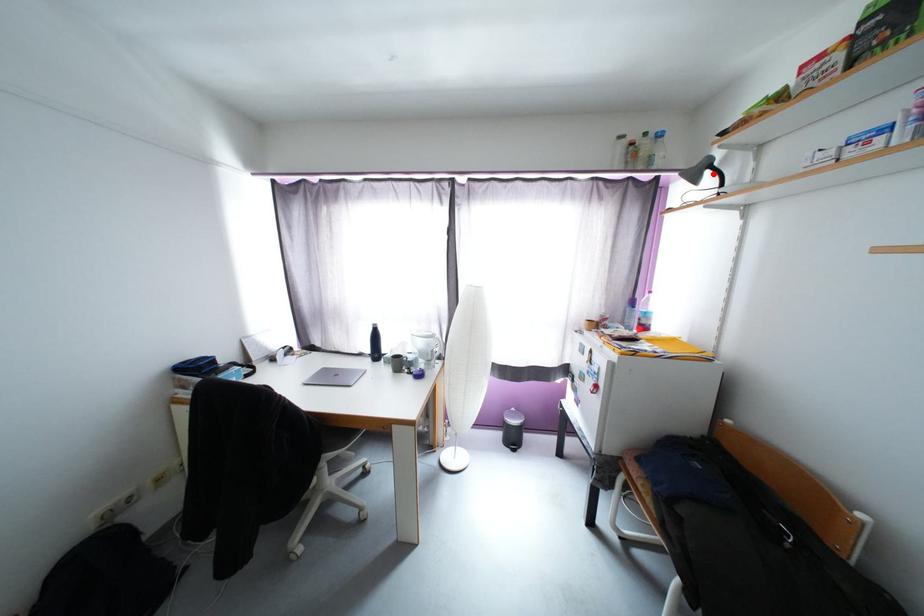
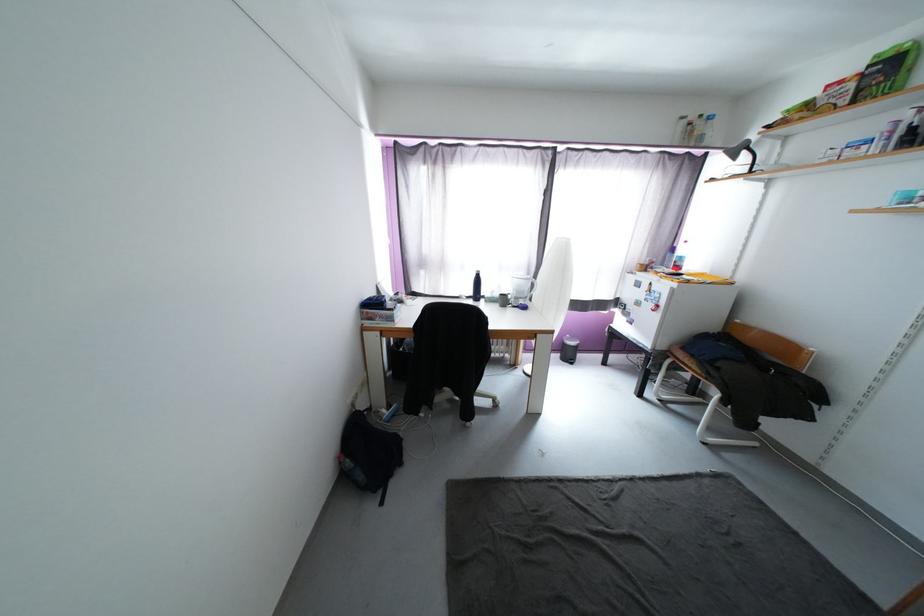
Where in the second image is the point corresponding to the highlighted location from the first image?

(749, 154)